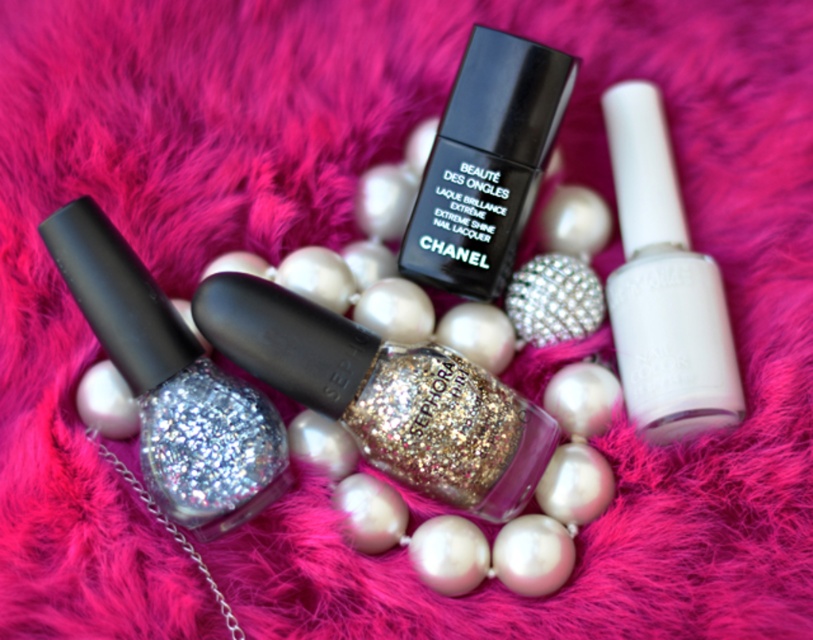
You are a beauty consultant arranging products on a display table. You have two points marked on the table where you need to place a nail polish bottle and a pearl necklace. The coordinates are point A at point (493, 477) and point B at point (222, 468). Which point is closer to the viewer and should be used for placing an item that needs to be more prominent?

Point A at point (493, 477) is closer to the viewer than point B at point (222, 468), so it should be used for placing an item that needs to be more prominent.

You are a customer at a beauty store and see the glittery metallic nail polish at center and the glittery silver nail polish at center on a display shelf. Which one is closer to you?

The glittery metallic nail polish at center is closer to you than the glittery silver nail polish at center.